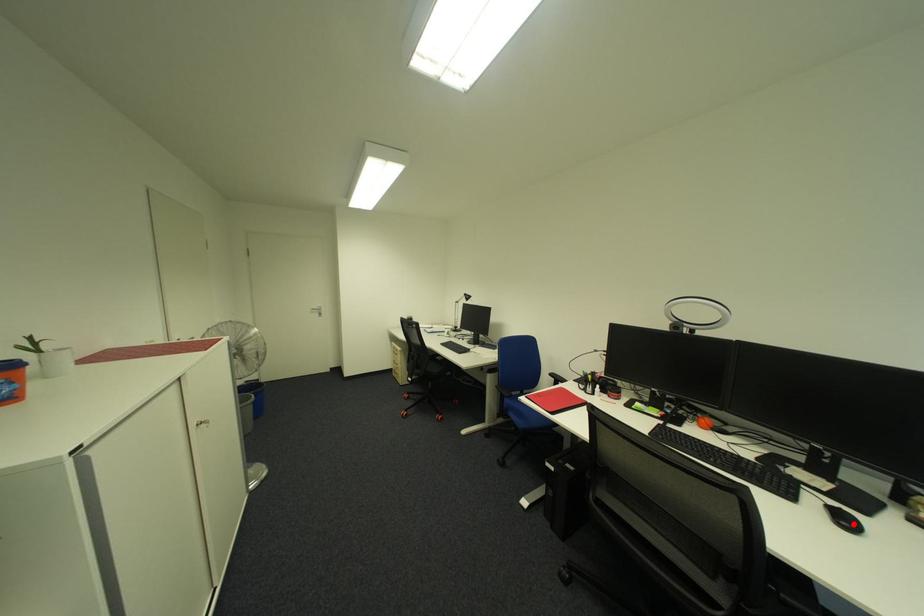
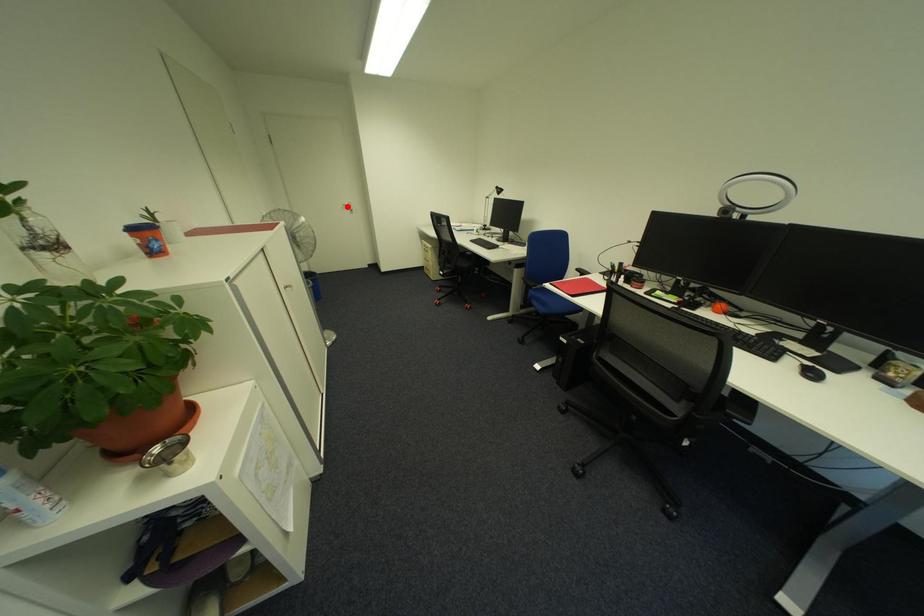
I am providing you with two images of the same scene from different viewpoints. A red point is marked on the first image and another point is marked on the second image. Do the highlighted points in image1 and image2 indicate the same real-world spot?

No